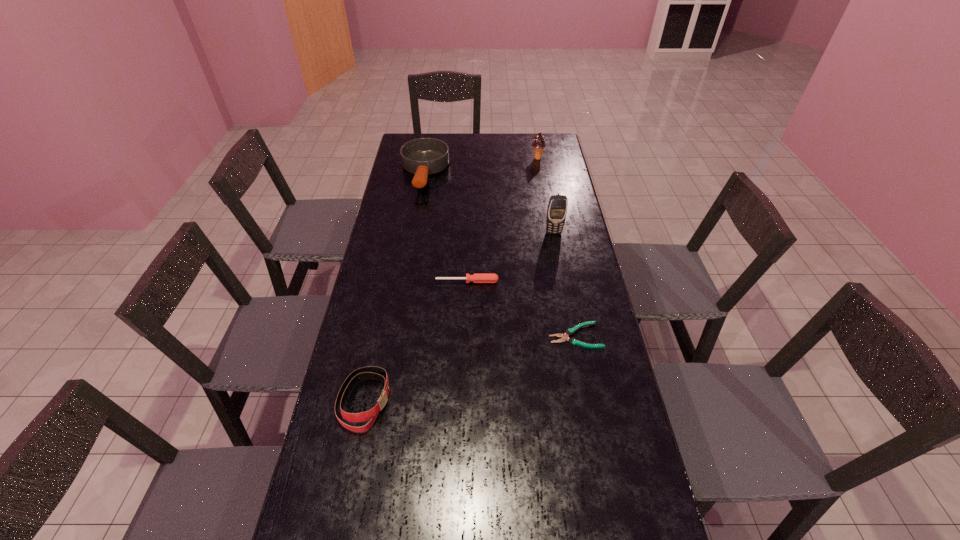
Identify the location of the third farthest object. (557, 207).

The width and height of the screenshot is (960, 540). I want to click on the tallest object, so click(557, 207).

In order to click on icecream in this screenshot , I will do `click(538, 143)`.

At what (x,y) coordinates should I click in order to perform the action: click on the fourth shortest object. Please return your answer as a coordinate pair (x, y). The image size is (960, 540). Looking at the image, I should click on (423, 156).

Locate an element on the screen. Image resolution: width=960 pixels, height=540 pixels. dog collar is located at coordinates (371, 371).

Where is `the third shortest object`? the third shortest object is located at coordinates (371, 371).

Find the location of a particular element. The width and height of the screenshot is (960, 540). screwdriver is located at coordinates (476, 277).

Find the location of a particular element. This screenshot has height=540, width=960. the second shortest object is located at coordinates (476, 277).

Where is `the shortest object`? the shortest object is located at coordinates (564, 337).

Identify the location of pliers. (564, 337).